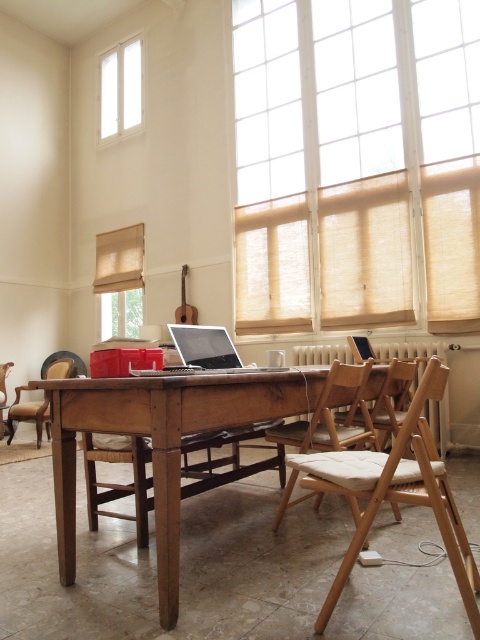
Question: Which of the following is the closest to the observer?

Choices:
 (A) (207, 362)
 (B) (0, 428)
 (C) (136, 35)

Answer: (A)

Question: Does light brown wooden chair at lower right come behind white glass window at upper left?

Choices:
 (A) no
 (B) yes

Answer: (A)

Question: Estimate the real-world distances between objects in this image. Which object is closer to the beige fabric window at upper right?

Choices:
 (A) white glass window at upper left
 (B) light brown wooden chair at center
 (C) light brown wooden chair at lower right
 (D) satin silver laptop at center

Answer: (A)

Question: Which object is farther from the camera taking this photo?

Choices:
 (A) brown wooden armchair at left
 (B) wooden table at center
 (C) white glass window at upper left
 (D) satin silver laptop at center

Answer: (C)

Question: Can you confirm if light brown wooden chair at lower right is positioned to the left of white glass window at upper left?

Choices:
 (A) no
 (B) yes

Answer: (A)

Question: Is wooden table at center positioned in front of light brown wooden chair at lower right?

Choices:
 (A) yes
 (B) no

Answer: (B)